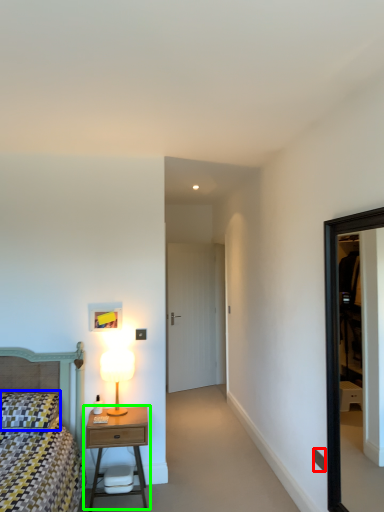
Question: Which object is positioned farthest from light switch (highlighted by a red box)? Select from pillow (highlighted by a blue box) and nightstand (highlighted by a green box).

Choices:
 (A) pillow
 (B) nightstand

Answer: (A)